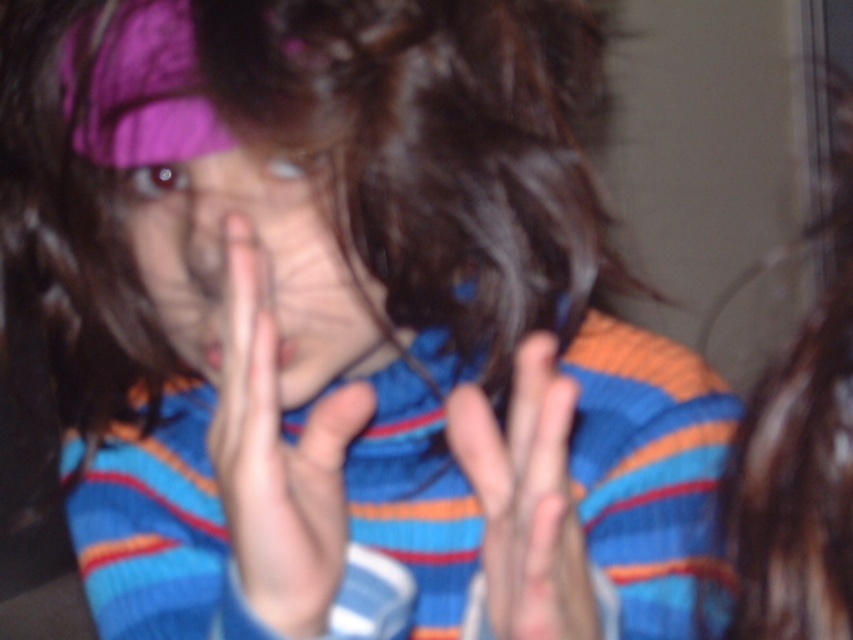
You are a photographer trying to frame a portrait. You notice the brown shiny hair at right and the smooth skin hand at center in your viewfinder. Based on their sizes, which object should you adjust your focus to ensure it fills the frame more appropriately?

The brown shiny hair at right is wider than the smooth skin hand at center, so you should adjust your focus to the brown shiny hair at right to ensure it fills the frame more appropriately.

You are a fashion designer preparing to take a photo of a model wearing a purple headband and posing with their hands. Based on the scene description, will the matte purple headband at center be wider than the smooth skin hands at center?

The matte purple headband at center might be wider than smooth skin hands at center according to the description.

You are a photographer setting up for a portrait session. You need to ensure that the matte purple headband at center is clearly visible in the photo. Given that the smooth skin hands at center are currently obscuring part of it, how can you adjust the composition to make sure the headband is fully visible?

Since the matte purple headband at center has a larger size compared to the smooth skin hands at center, you can position the hands slightly lower or further away from the headband to ensure it remains fully visible without obstruction.